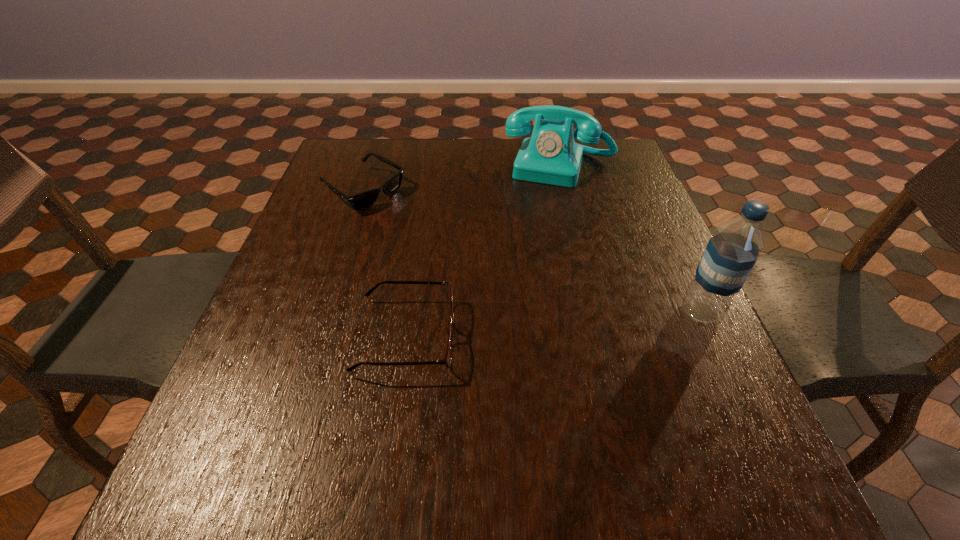
What are the coordinates of `object that stands as the closest to the spectacles` in the screenshot? It's located at (363, 200).

The width and height of the screenshot is (960, 540). What are the coordinates of `free space that satisfies the following two spatial constraints: 1. on the front side of the telephone; 2. on the label of the water bottle` in the screenshot? It's located at (594, 312).

Identify the location of vacant position in the image that satisfies the following two spatial constraints: 1. on the front side of the sunglasses; 2. on the label of the tallest object. The height and width of the screenshot is (540, 960). (324, 312).

You are a GUI agent. You are given a task and a screenshot of the screen. Output one action in this format:
    pyautogui.click(x=<x>, y=<y>)
    Task: Click on the vacant space that satisfies the following two spatial constraints: 1. on the front side of the telephone; 2. on the label of the rightmost object
    This screenshot has width=960, height=540.
    Given the screenshot: What is the action you would take?
    pyautogui.click(x=594, y=312)

Locate an element on the screen. The height and width of the screenshot is (540, 960). free space that satisfies the following two spatial constraints: 1. on the back side of the telephone; 2. on the left side of the sunglasses is located at coordinates (372, 167).